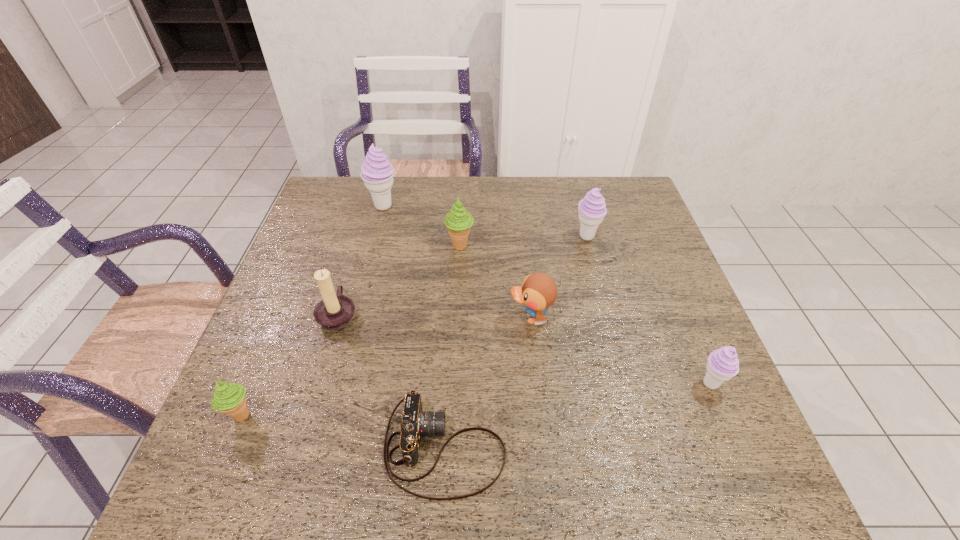
This screenshot has height=540, width=960. In order to click on free space at the far edge in this screenshot , I will do `click(483, 188)`.

You are a GUI agent. You are given a task and a screenshot of the screen. Output one action in this format:
    pyautogui.click(x=<x>, y=<y>)
    Task: Click on the free location at the near edge of the desktop
    
    Given the screenshot: What is the action you would take?
    pyautogui.click(x=326, y=463)

I want to click on vacant region at the left edge, so click(326, 263).

In the image, there is a desktop. At what (x,y) coordinates should I click in order to perform the action: click on vacant space at the right edge. Please return your answer as a coordinate pair (x, y). The height and width of the screenshot is (540, 960). Looking at the image, I should click on (655, 306).

At what (x,y) coordinates should I click in order to perform the action: click on free spot between the leftmost icecream and the blue duck. Please return your answer as a coordinate pair (x, y). Looking at the image, I should click on pyautogui.click(x=386, y=366).

Find the location of `free spot between the blue duck and the brown candle holder`. free spot between the blue duck and the brown candle holder is located at coordinates (435, 316).

At what (x,y) coordinates should I click in order to perform the action: click on empty space between the second farthest purple icecream and the candle holder. Please return your answer as a coordinate pair (x, y). Looking at the image, I should click on (463, 275).

I want to click on free space between the seventh object from left to right and the brown camera, so click(516, 342).

Locate an element on the screen. vacant area between the nearer green icecream and the second purple icecream from right to left is located at coordinates (414, 326).

The image size is (960, 540). In order to click on blank region between the right green icecream and the brown camera in this screenshot , I will do (452, 347).